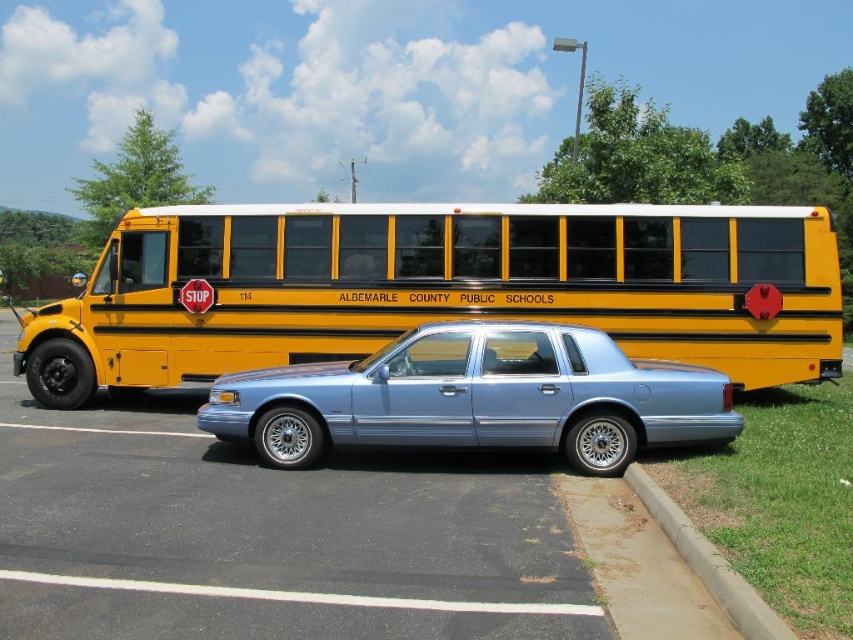
You are a pedestrian standing at the edge of the parking lot. You see the metallic blue sedan at center and the concrete at lower right. Which object is closer to the curb?

The metallic blue sedan at center is closer to the curb because it is positioned to the left of the concrete at lower right, which is further away from the curb.

You are standing at the curb near the light blue sedan parked at the edge of the parking lot. You need to walk to the yellow matte bus at center. Which direction should you walk relative to the light blue sedan?

The yellow matte bus at center is located at point (437,288), which is ahead and to the right of the light blue sedan. Therefore, you should walk forward and slightly to your right relative to the light blue sedan to reach the yellow matte bus at center.

You are a delivery driver who needs to park your truck in the parking lot. You see the metallic blue sedan at center and concrete at lower right. Which area has enough space to accommodate your truck?

The metallic blue sedan at center is bigger than concrete at lower right, so the concrete at lower right is too small to fit the truck. The metallic blue sedan at center is larger and may have more space available.